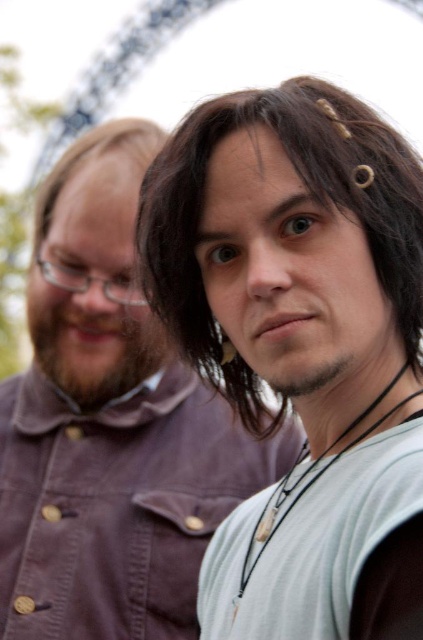
Who is more distant from viewer, (384, 216) or (403, 552)?

Positioned behind is point (384, 216).

Between dark brown hair at center and light gray fabric at center, which one is positioned lower?

light gray fabric at center is below.

Is point (272, 124) farther from viewer compared to point (249, 497)?

No, (272, 124) is closer to viewer.

The image size is (423, 640). Identify the location of dark brown hair at center. (x=312, y=196).

Measure the distance between matte brown shirt at center and dark brown hair at center.

matte brown shirt at center is 21.15 meters from dark brown hair at center.

Between matte brown shirt at center and dark brown hair at center, which one appears on the left side from the viewer's perspective?

Positioned to the left is matte brown shirt at center.

Is point (30, 426) positioned behind point (392, 140)?

Yes, it is behind point (392, 140).

Where is `matte brown shirt at center`? The width and height of the screenshot is (423, 640). matte brown shirt at center is located at coordinates (109, 426).

Which is above, matte brown shirt at center or brown matte hair at upper left?

Positioned higher is brown matte hair at upper left.

How much distance is there between matte brown shirt at center and brown matte hair at upper left?

matte brown shirt at center is 67.73 feet from brown matte hair at upper left.

Where is `matte brown shirt at center`? matte brown shirt at center is located at coordinates 109,426.

You are a GUI agent. You are given a task and a screenshot of the screen. Output one action in this format:
    pyautogui.click(x=<x>, y=<y>)
    Task: Click on the matte brown shirt at center
    
    Given the screenshot: What is the action you would take?
    click(109, 426)